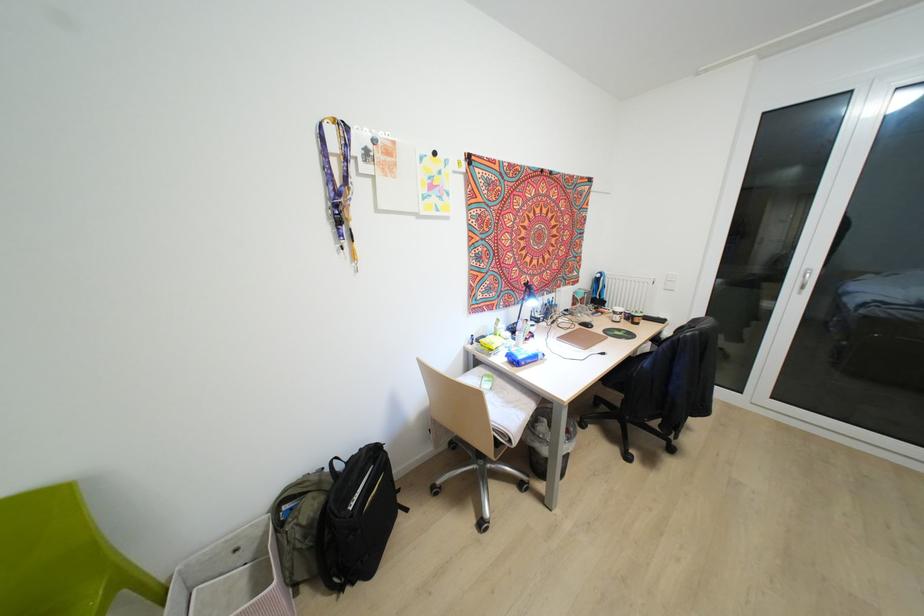
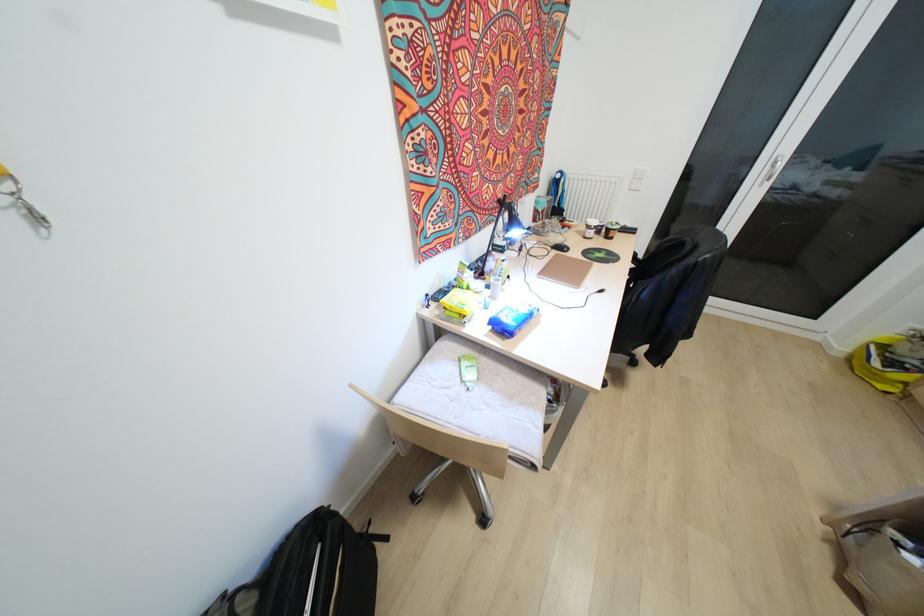
Where in the second image is the point corresponding to pixel 406 509 from the first image?

(385, 538)